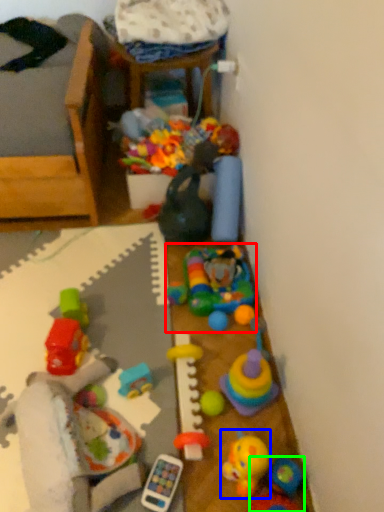
Question: Which object is the farthest from toy (highlighted by a red box)? Choose among these: toy (highlighted by a blue box) or toy (highlighted by a green box).

Choices:
 (A) toy
 (B) toy

Answer: (B)